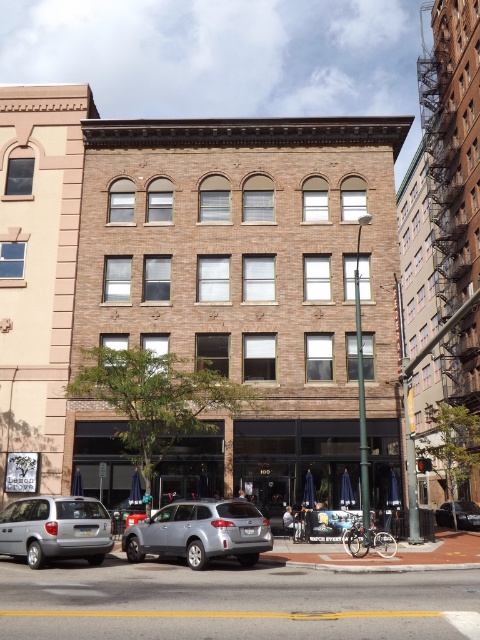
Question: Is silver metallic minivan at lower left bigger than silver metallic sedan at center?

Choices:
 (A) no
 (B) yes

Answer: (A)

Question: Can you confirm if silver metallic minivan at lower left is positioned to the left of silver metallic sedan at center?

Choices:
 (A) yes
 (B) no

Answer: (A)

Question: Which object is positioned closest to the silver metallic sedan at center?

Choices:
 (A) satin silver suv at center
 (B) silver metallic minivan at lower left

Answer: (A)

Question: Among these objects, which one is farthest from the camera?

Choices:
 (A) satin silver suv at center
 (B) silver metallic sedan at center
 (C) silver metallic minivan at lower left

Answer: (B)

Question: Can you confirm if satin silver suv at center is bigger than silver metallic minivan at lower left?

Choices:
 (A) no
 (B) yes

Answer: (B)

Question: Which of the following is the closest to the observer?

Choices:
 (A) (159, 528)
 (B) (472, 524)

Answer: (A)